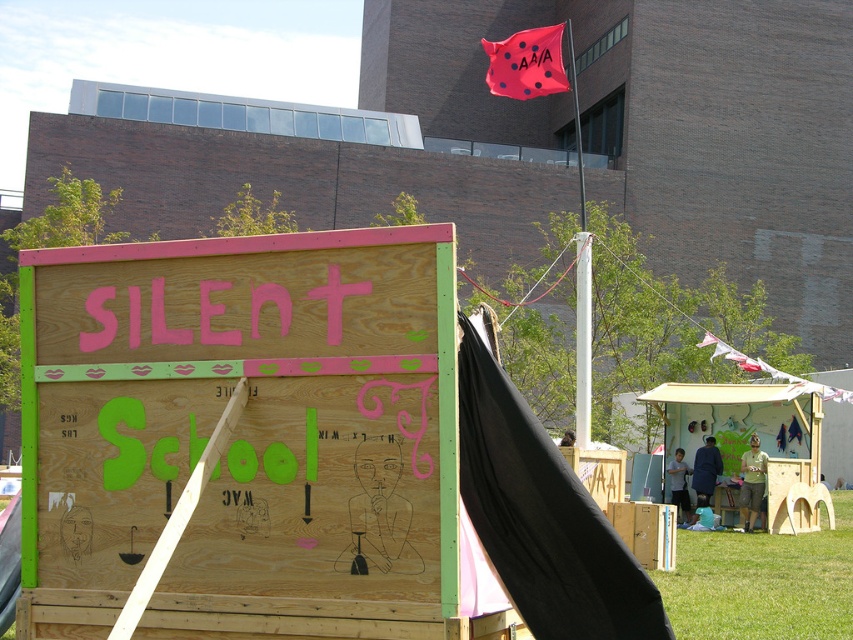
Consider the image. Who is shorter, wooden signboard at center or green grass at lower right?

green grass at lower right

Who is positioned more to the left, wooden signboard at center or green grass at lower right?

wooden signboard at center is more to the left.

Does point (387, 307) come in front of point (805, 636)?

Yes, point (387, 307) is in front of point (805, 636).

Identify the location of wooden signboard at center. The image size is (853, 640). (242, 433).

Identify the location of pink fabric flag at upper center. The height and width of the screenshot is (640, 853). (526, 64).

This screenshot has width=853, height=640. In order to click on pink fabric flag at upper center in this screenshot , I will do `click(526, 64)`.

Is point (221, 349) behind point (838, 394)?

No, it is not.

Between wooden signboard at center and red fabric flag at upper right, which one has more height?

wooden signboard at center

Does point (305, 410) lie in front of point (730, 349)?

That is True.

Where is `wooden signboard at center`? This screenshot has width=853, height=640. wooden signboard at center is located at coordinates (242, 433).